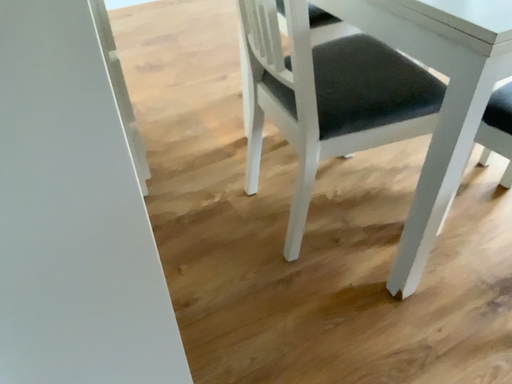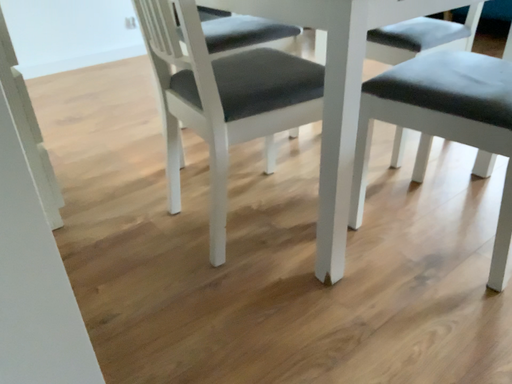
Question: Which way did the camera rotate in the video?

Choices:
 (A) rotated right
 (B) rotated left

Answer: (A)